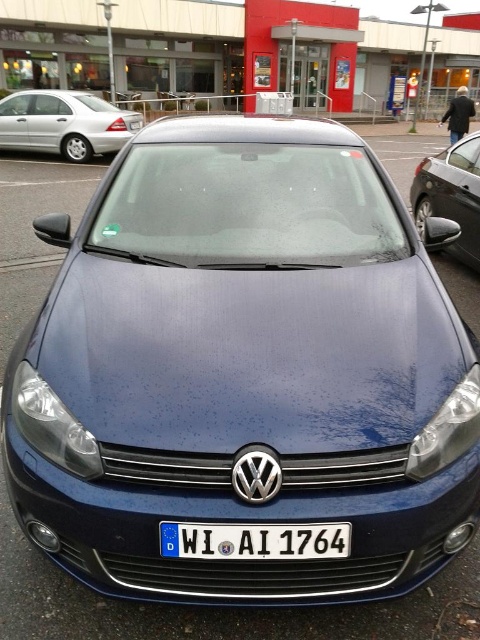
Between point (326, 540) and point (467, 156), which one is positioned behind?

Positioned behind is point (467, 156).

Does point (193, 545) lie in front of point (450, 163)?

That is True.

Between point (320, 536) and point (468, 138), which one is positioned behind?

Point (468, 138)

Identify the location of white plastic license plate at center. This screenshot has height=640, width=480. (254, 540).

Is silver metallic sedan at left further to the viewer compared to white plastic license plate at center?

Yes, silver metallic sedan at left is further from the viewer.

Is silver metallic sedan at left thinner than white plastic license plate at center?

Incorrect, silver metallic sedan at left's width is not less than white plastic license plate at center's.

Identify the location of silver metallic sedan at left. The image size is (480, 640). (63, 124).

The image size is (480, 640). What do you see at coordinates (63, 124) in the screenshot?
I see `silver metallic sedan at left` at bounding box center [63, 124].

Image resolution: width=480 pixels, height=640 pixels. Find the location of `silver metallic sedan at left`. silver metallic sedan at left is located at coordinates (63, 124).